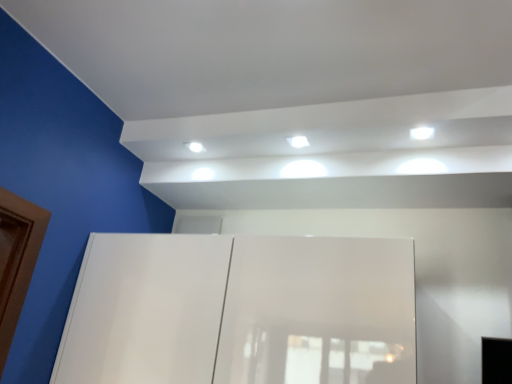
What do you see at coordinates (421, 133) in the screenshot? I see `white glossy light at upper right, which is the first light from front to back` at bounding box center [421, 133].

Describe the element at coordinates (298, 141) in the screenshot. I see `white glossy light at center, which is counted as the second light, starting from the right` at that location.

Find the location of a particular element. The height and width of the screenshot is (384, 512). white glossy light at upper right, acting as the second light starting from the back is located at coordinates (421, 133).

How different are the orientations of white glossy light fixture at upper center and white glossy light at upper right, the 2th light in the left-to-right sequence, in degrees?

0.777 degrees separate the facing orientations of white glossy light fixture at upper center and white glossy light at upper right, the 2th light in the left-to-right sequence.

Could you tell me if white glossy light fixture at upper center is turned towards white glossy light at upper right, the 1th light from the right?

No, white glossy light fixture at upper center is not facing towards white glossy light at upper right, the 1th light from the right.

Consider the image. From the image's perspective, is white glossy light fixture at upper center over white glossy light at upper right, which is the first light from front to back?

No, from the image's perspective, white glossy light fixture at upper center is not above white glossy light at upper right, which is the first light from front to back.

Looking at this image, considering the positions of objects white glossy light fixture at upper center and white glossy light at upper right, which is the first light from front to back, in the image provided, who is behind, white glossy light fixture at upper center or white glossy light at upper right, which is the first light from front to back,?

white glossy light fixture at upper center is further away from the camera.

The height and width of the screenshot is (384, 512). Find the location of `the 1st light located above the white glossy light fixture at upper center (from a real-world perspective)`. the 1st light located above the white glossy light fixture at upper center (from a real-world perspective) is located at coordinates (421, 133).

In the scene shown: Measure the distance from white glossy light at upper right, the 1th light from the right, to white glossy light fixture at upper center.

35.52 inches.

Does white glossy light at upper right, the 1th light from the right, come in front of white glossy light fixture at upper center?

Yes, the depth of white glossy light at upper right, the 1th light from the right, is less than that of white glossy light fixture at upper center.

Is white glossy light at upper right, acting as the second light starting from the back, not inside white glossy light fixture at upper center?

Indeed, white glossy light at upper right, acting as the second light starting from the back, is completely outside white glossy light fixture at upper center.

Is point (301, 143) closer or farther from the camera than point (431, 134)?

Point (301, 143) is farther from the camera than point (431, 134).

In the scene shown: Is white glossy light at center, the 1th light in the left-to-right sequence, situated inside white glossy light at upper right, the 1th light from the right, or outside?

white glossy light at center, the 1th light in the left-to-right sequence, lies outside white glossy light at upper right, the 1th light from the right.

From the image's perspective, which object appears higher, white glossy light at center, placed as the second light when sorted from front to back, or white glossy light at upper right, which is the first light from front to back?

white glossy light at upper right, which is the first light from front to back, is shown above in the image.

Considering the relative sizes of white glossy light at center, arranged as the 1th light when viewed from the back, and white glossy light at upper right, the 1th light from the right, in the image provided, is white glossy light at center, arranged as the 1th light when viewed from the back, thinner than white glossy light at upper right, the 1th light from the right,?

Correct, the width of white glossy light at center, arranged as the 1th light when viewed from the back, is less than that of white glossy light at upper right, the 1th light from the right.

Looking at this image, can you confirm if white glossy light at upper right, which is the first light from front to back, is positioned to the right of white glossy light at center, the 1th light in the left-to-right sequence?

Yes.

Which is behind, point (422, 139) or point (302, 136)?

The point (302, 136) is farther.

Measure the distance between white glossy light at upper right, the 2th light in the left-to-right sequence, and white glossy light at center, which is counted as the second light, starting from the right.

A distance of 17.18 inches exists between white glossy light at upper right, the 2th light in the left-to-right sequence, and white glossy light at center, which is counted as the second light, starting from the right.

Is white glossy light at upper right, which is the first light from front to back, not close to white glossy light at center, arranged as the 1th light when viewed from the back?

No, white glossy light at upper right, which is the first light from front to back, is not far away from white glossy light at center, arranged as the 1th light when viewed from the back.

Considering the relative sizes of white glossy light at center, the 1th light in the left-to-right sequence, and white glossy light fixture at upper center in the image provided, is white glossy light at center, the 1th light in the left-to-right sequence, taller than white glossy light fixture at upper center?

Correct, white glossy light at center, the 1th light in the left-to-right sequence, is much taller as white glossy light fixture at upper center.

Which is closer to the camera, (x=302, y=144) or (x=197, y=144)?

Point (x=302, y=144) is closer to the camera than point (x=197, y=144).

Is white glossy light at center, placed as the second light when sorted from front to back, positioned far away from white glossy light fixture at upper center?

white glossy light at center, placed as the second light when sorted from front to back, is actually quite close to white glossy light fixture at upper center.

Is white glossy light at center, which is counted as the second light, starting from the right, positioned with its back to white glossy light fixture at upper center?

No, white glossy light at center, which is counted as the second light, starting from the right,'s orientation is not away from white glossy light fixture at upper center.

Is white glossy light fixture at upper center situated inside white glossy light at center, which is counted as the second light, starting from the right, or outside?

white glossy light fixture at upper center is located beyond the bounds of white glossy light at center, which is counted as the second light, starting from the right.

From the image's perspective, which is below, white glossy light fixture at upper center or white glossy light at center, arranged as the 1th light when viewed from the back?

white glossy light fixture at upper center is shown below in the image.

From a real-world perspective, between white glossy light fixture at upper center and white glossy light at center, the 1th light in the left-to-right sequence, who is vertically lower?

In real-world perspective, white glossy light fixture at upper center is lower.

The height and width of the screenshot is (384, 512). In order to click on the 2nd light directly above the white glossy light fixture at upper center (from a real-world perspective) in this screenshot , I will do (298, 141).

Where is `light that is the 2nd object to the right of the white glossy light fixture at upper center, starting at the anchor`? This screenshot has width=512, height=384. light that is the 2nd object to the right of the white glossy light fixture at upper center, starting at the anchor is located at coordinates (421, 133).

The height and width of the screenshot is (384, 512). I want to click on dot on the left of the white glossy light at upper right, which is the first light from front to back, so click(195, 147).

From the image, which object appears to be nearer to white glossy light at upper right, the 2th light in the left-to-right sequence, white glossy light at center, the 1th light in the left-to-right sequence, or white glossy light fixture at upper center?

white glossy light at center, the 1th light in the left-to-right sequence, is closer to white glossy light at upper right, the 2th light in the left-to-right sequence.

Looking at the image, which one is located closer to white glossy light at center, placed as the second light when sorted from front to back, white glossy light at upper right, acting as the second light starting from the back, or white glossy light fixture at upper center?

white glossy light fixture at upper center is closer to white glossy light at center, placed as the second light when sorted from front to back.

Estimate the real-world distances between objects in this image. Which object is further from white glossy light at center, which is counted as the second light, starting from the right, white glossy light fixture at upper center or white glossy light at upper right, the 1th light from the right?

white glossy light at upper right, the 1th light from the right, is positioned further to the anchor white glossy light at center, which is counted as the second light, starting from the right.

Which object lies nearer to the anchor point white glossy light at upper right, acting as the second light starting from the back, white glossy light fixture at upper center or white glossy light at center, arranged as the 1th light when viewed from the back?

white glossy light at center, arranged as the 1th light when viewed from the back, is positioned closer to the anchor white glossy light at upper right, acting as the second light starting from the back.

Estimate the real-world distances between objects in this image. Which object is further from white glossy light fixture at upper center, white glossy light at center, which is counted as the second light, starting from the right, or white glossy light at upper right, which is the first light from front to back?

Based on the image, white glossy light at upper right, which is the first light from front to back, appears to be further to white glossy light fixture at upper center.

Looking at the image, which one is located closer to white glossy light fixture at upper center, white glossy light at upper right, the 1th light from the right, or white glossy light at center, placed as the second light when sorted from front to back?

Based on the image, white glossy light at center, placed as the second light when sorted from front to back, appears to be nearer to white glossy light fixture at upper center.

Locate an element on the screen. The height and width of the screenshot is (384, 512). light located between white glossy light fixture at upper center and white glossy light at upper right, the 1th light from the right, in the left-right direction is located at coordinates (298, 141).